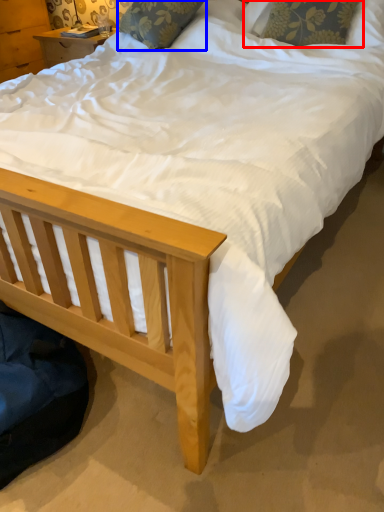
Question: Which object is further to the camera taking this photo, pillow (highlighted by a red box) or pillow (highlighted by a blue box)?

Choices:
 (A) pillow
 (B) pillow

Answer: (B)